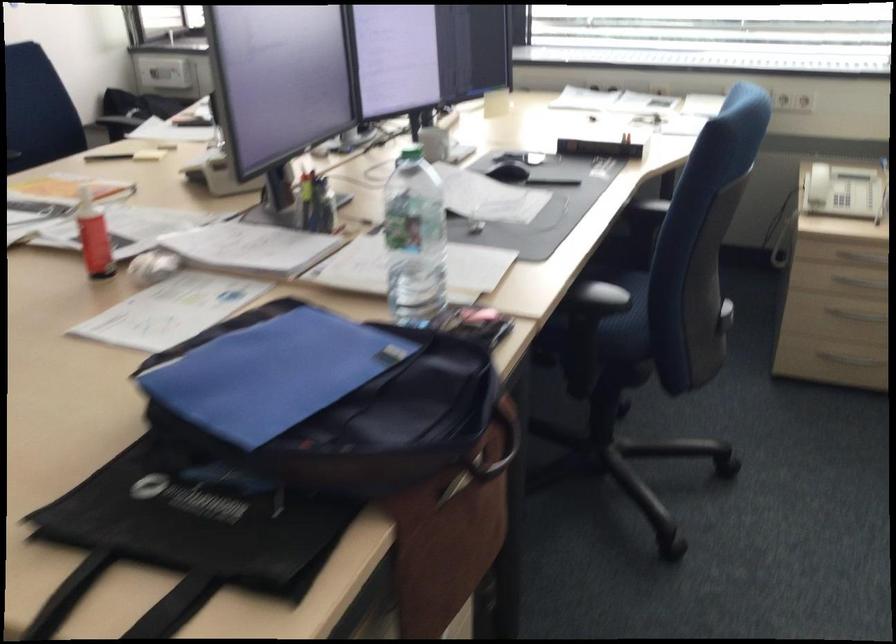
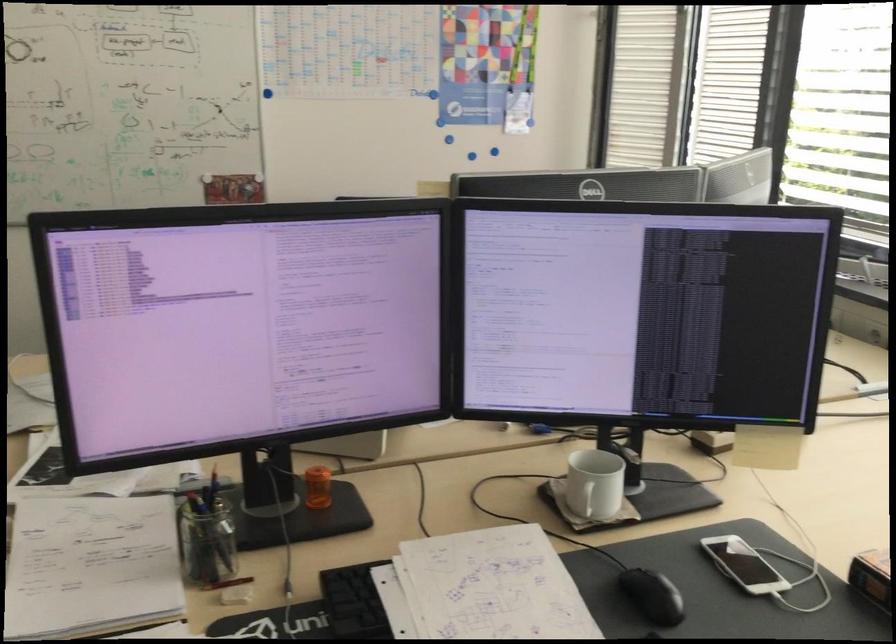
Question: I am providing you with two images of the same scene from different viewpoints. After the viewpoint changes to image2, which objects are now occluded?

Choices:
 (A) black pen
 (B) black office phone
 (C) glass pencil holder
 (D) white eraser

Answer: (A)